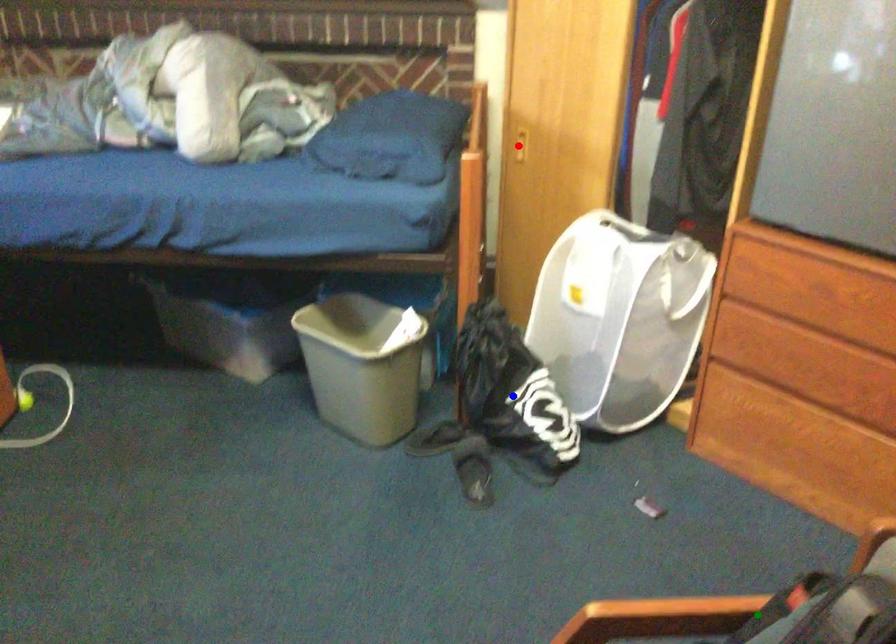
Order these from nearest to farthest:
blue point
red point
green point

green point
blue point
red point